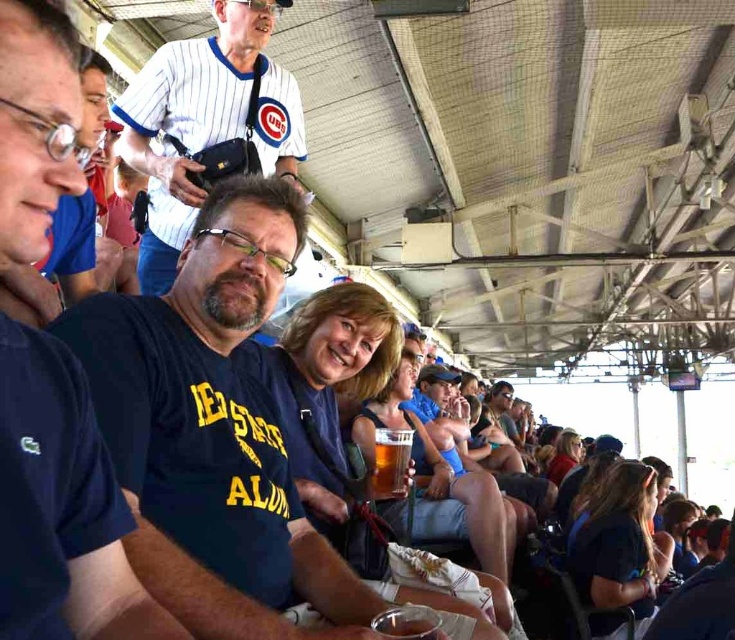
Who is higher up, blue cotton t-shirt at center or translucent plastic cup at lower center?

Positioned higher is blue cotton t-shirt at center.

Can you confirm if blue cotton t-shirt at center is shorter than translucent plastic cup at lower center?

Incorrect, blue cotton t-shirt at center's height does not fall short of translucent plastic cup at lower center's.

The height and width of the screenshot is (640, 735). Describe the element at coordinates (212, 429) in the screenshot. I see `blue cotton t-shirt at center` at that location.

You are a GUI agent. You are given a task and a screenshot of the screen. Output one action in this format:
    pyautogui.click(x=<x>, y=<y>)
    Task: Click on the blue cotton t-shirt at center
    
    Given the screenshot: What is the action you would take?
    pyautogui.click(x=212, y=429)

Which is in front, point (50, 8) or point (381, 444)?

Point (50, 8) is in front.

Does blue fabric shirt at left have a lesser width compared to translucent glass at center?

Incorrect, blue fabric shirt at left's width is not less than translucent glass at center's.

Identify the location of blue fabric shirt at left. (76, 497).

In order to click on blue fabric shirt at left in this screenshot , I will do `click(76, 497)`.

Which of these two, blue fabric shirt at left or translucent plastic cup at lower center, stands shorter?

translucent plastic cup at lower center is shorter.

Is blue fabric shirt at left above translucent plastic cup at lower center?

Indeed, blue fabric shirt at left is positioned over translucent plastic cup at lower center.

Between point (32, 492) and point (420, 616), which one is positioned behind?

Positioned behind is point (420, 616).

This screenshot has width=735, height=640. Identify the location of blue fabric shirt at left. (76, 497).